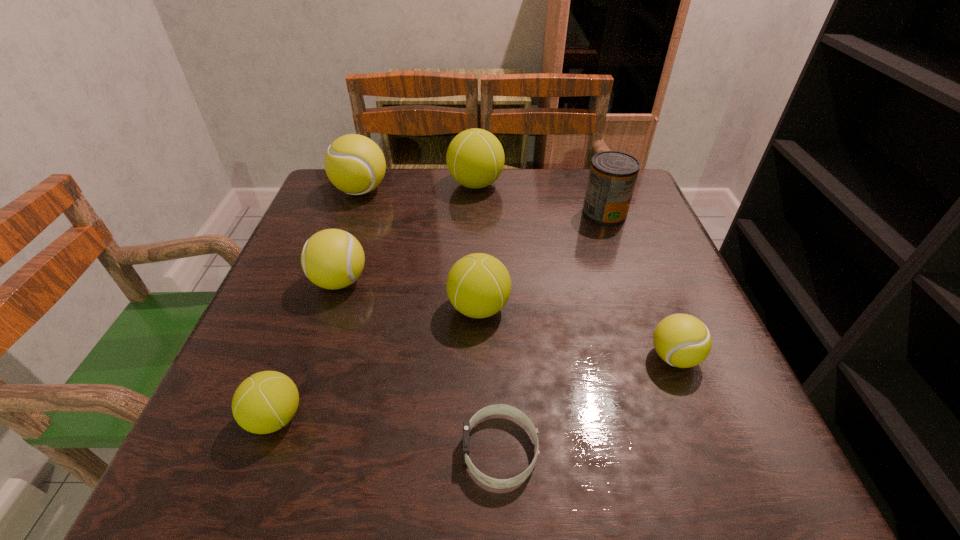
What are the coordinates of `green tennis ball that stands as the third closest to the wristband` in the screenshot? It's located at (475, 158).

Locate which green tennis ball ranks third in proximity to the smallest yellow tennis ball. Please provide its 2D coordinates. Your answer should be formatted as a tuple, i.e. [(x, y)], where the tuple contains the x and y coordinates of a point satisfying the conditions above.

[(266, 401)]

Find the location of a particular element. free space in the image that satisfies the following two spatial constraints: 1. on the front side of the biggest green tennis ball; 2. on the right side of the second nearest green tennis ball is located at coordinates (474, 308).